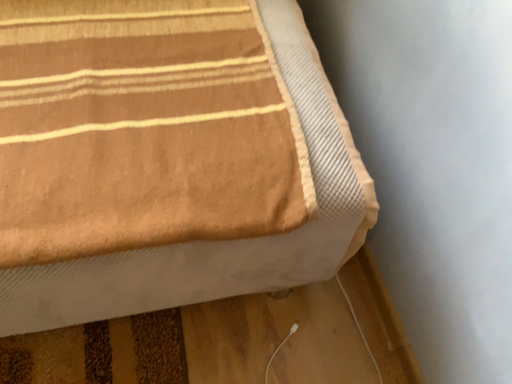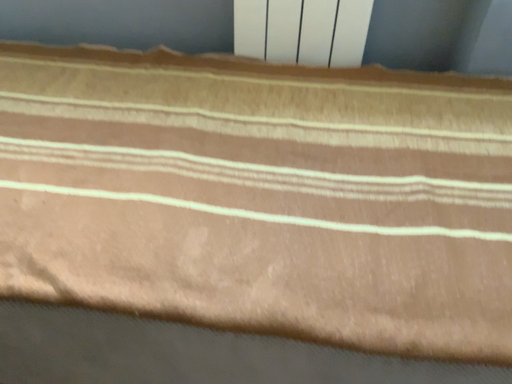
Question: Which way did the camera rotate in the video?

Choices:
 (A) rotated right
 (B) rotated left

Answer: (B)